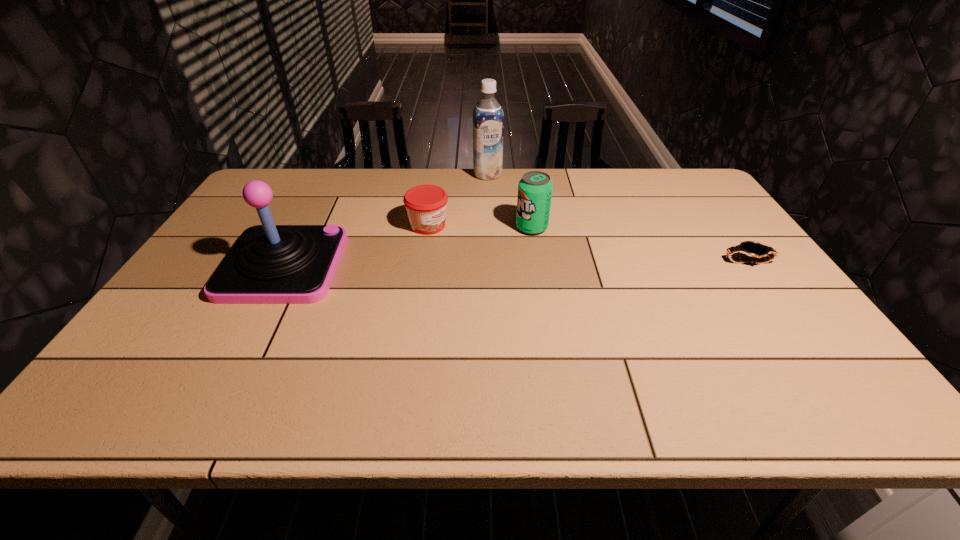
Where is `free region located 0.250m on the label side of the fourth object from right to left`? free region located 0.250m on the label side of the fourth object from right to left is located at coordinates (514, 264).

The width and height of the screenshot is (960, 540). Find the location of `object that is at the far edge`. object that is at the far edge is located at coordinates (488, 118).

The image size is (960, 540). What are the coordinates of `object located at the left edge` in the screenshot? It's located at [x=269, y=264].

Image resolution: width=960 pixels, height=540 pixels. I want to click on object that is at the right edge, so tap(750, 248).

At what (x,y) coordinates should I click in order to perform the action: click on vacant space at the far edge of the desktop. Please return your answer as a coordinate pair (x, y). This screenshot has height=540, width=960. Looking at the image, I should click on (507, 170).

This screenshot has width=960, height=540. Identify the location of free region at the near edge of the desktop. (634, 364).

Identify the location of vacant region at the left edge of the desktop. (167, 332).

Where is `free space at the near right corner`? Image resolution: width=960 pixels, height=540 pixels. free space at the near right corner is located at coordinates (812, 348).

Locate an element on the screen. The height and width of the screenshot is (540, 960). free space between the pop soda and the rightmost object is located at coordinates (640, 245).

This screenshot has width=960, height=540. I want to click on free point between the rightmost object and the third object from right to left, so click(x=618, y=218).